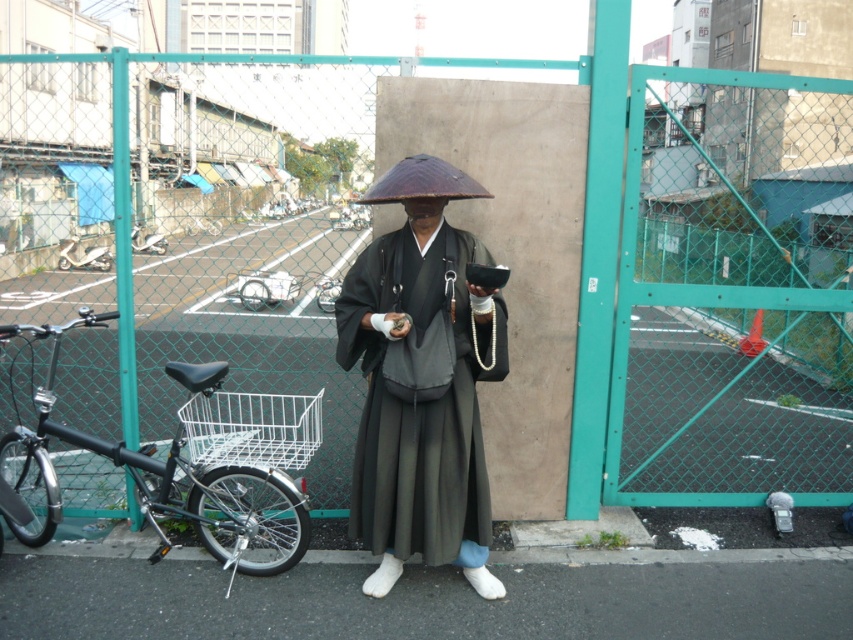
Based on the photo, between green chain-link fence at center and shiny brown umbrella at center, which one appears on the right side from the viewer's perspective?

Positioned to the right is green chain-link fence at center.

Does green chain-link fence at center have a greater width compared to shiny brown umbrella at center?

Yes.

Identify the location of green chain-link fence at center. The image size is (853, 640). (567, 252).

Does point (431, 476) come behind point (64, 253)?

No, it is in front of (64, 253).

Does point (485, 536) come in front of point (103, 269)?

Yes, point (485, 536) is closer to viewer.

Locate an element on the screen. The image size is (853, 640). black silk kimono at center is located at coordinates (416, 404).

Who is shorter, black silk kimono at center or shiny brown umbrella at center?

shiny brown umbrella at center is shorter.

Does black silk kimono at center have a smaller size compared to shiny brown umbrella at center?

No.

Is point (393, 532) behind point (380, 196)?

Yes, point (393, 532) is behind point (380, 196).

I want to click on black silk kimono at center, so click(x=416, y=404).